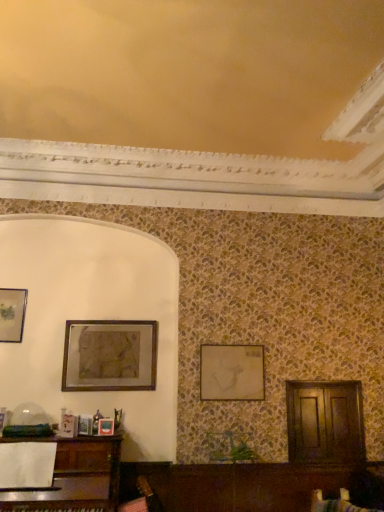
Question: Does matte gold picture frame at upper left, arranged as the third picture frame when viewed from the right, have a lesser height compared to wooden framed artwork at upper left, acting as the second picture frame starting from the left?

Choices:
 (A) yes
 (B) no

Answer: (A)

Question: Is matte gold picture frame at upper left, arranged as the third picture frame when viewed from the right, not within wooden framed artwork at upper left, acting as the second picture frame starting from the left?

Choices:
 (A) no
 (B) yes

Answer: (B)

Question: Is matte gold picture frame at upper left, arranged as the third picture frame when viewed from the right, touching wooden framed artwork at upper left, which is the 2th picture frame from right to left?

Choices:
 (A) yes
 (B) no

Answer: (B)

Question: Can wooden framed artwork at upper left, which is the 2th picture frame from right to left, be found inside matte gold picture frame at upper left, arranged as the third picture frame when viewed from the right?

Choices:
 (A) yes
 (B) no

Answer: (B)

Question: Does matte gold picture frame at upper left, which is counted as the first picture frame, starting from the left, have a greater width compared to wooden framed artwork at upper left, which is the 2th picture frame from right to left?

Choices:
 (A) yes
 (B) no

Answer: (B)

Question: Does point (140, 352) appear closer or farther from the camera than point (241, 385)?

Choices:
 (A) closer
 (B) farther

Answer: (B)

Question: From a real-world perspective, is wooden framed artwork at upper left, which is the 2th picture frame from right to left, physically located above or below matte gold picture frame at center, positioned as the third picture frame in left-to-right order?

Choices:
 (A) below
 (B) above

Answer: (B)

Question: Considering the positions of wooden framed artwork at upper left, acting as the second picture frame starting from the left, and matte gold picture frame at center, positioned as the first picture frame in right-to-left order, in the image, is wooden framed artwork at upper left, acting as the second picture frame starting from the left, taller or shorter than matte gold picture frame at center, positioned as the first picture frame in right-to-left order,?

Choices:
 (A) short
 (B) tall

Answer: (B)

Question: From the image's perspective, is wooden framed artwork at upper left, which is the 2th picture frame from right to left, located above or below matte gold picture frame at center, positioned as the first picture frame in right-to-left order?

Choices:
 (A) above
 (B) below

Answer: (A)

Question: Considering the positions of matte gold picture frame at upper left, arranged as the third picture frame when viewed from the right, and matte gold picture frame at center, positioned as the third picture frame in left-to-right order, in the image, is matte gold picture frame at upper left, arranged as the third picture frame when viewed from the right, wider or thinner than matte gold picture frame at center, positioned as the third picture frame in left-to-right order,?

Choices:
 (A) wide
 (B) thin

Answer: (B)

Question: Is matte gold picture frame at upper left, which is counted as the first picture frame, starting from the left, situated inside matte gold picture frame at center, positioned as the first picture frame in right-to-left order, or outside?

Choices:
 (A) inside
 (B) outside

Answer: (B)

Question: From a real-world perspective, relative to matte gold picture frame at center, positioned as the first picture frame in right-to-left order, is matte gold picture frame at upper left, arranged as the third picture frame when viewed from the right, vertically above or below?

Choices:
 (A) above
 (B) below

Answer: (A)

Question: Looking at the image, does matte gold picture frame at upper left, which is counted as the first picture frame, starting from the left, seem bigger or smaller compared to matte gold picture frame at center, positioned as the third picture frame in left-to-right order?

Choices:
 (A) big
 (B) small

Answer: (B)

Question: Considering the positions of wooden framed artwork at upper left, acting as the second picture frame starting from the left, and matte gold picture frame at upper left, which is counted as the first picture frame, starting from the left, in the image, is wooden framed artwork at upper left, acting as the second picture frame starting from the left, taller or shorter than matte gold picture frame at upper left, which is counted as the first picture frame, starting from the left,?

Choices:
 (A) short
 (B) tall

Answer: (B)

Question: From a real-world perspective, is wooden framed artwork at upper left, acting as the second picture frame starting from the left, above or below matte gold picture frame at upper left, which is counted as the first picture frame, starting from the left?

Choices:
 (A) above
 (B) below

Answer: (B)